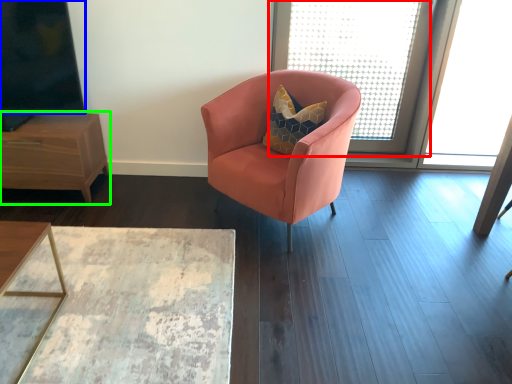
Question: Considering the real-world distances, which object is farthest from window screen (highlighted by a red box)? window screen (highlighted by a blue box) or nightstand (highlighted by a green box)?

Choices:
 (A) window screen
 (B) nightstand

Answer: (B)